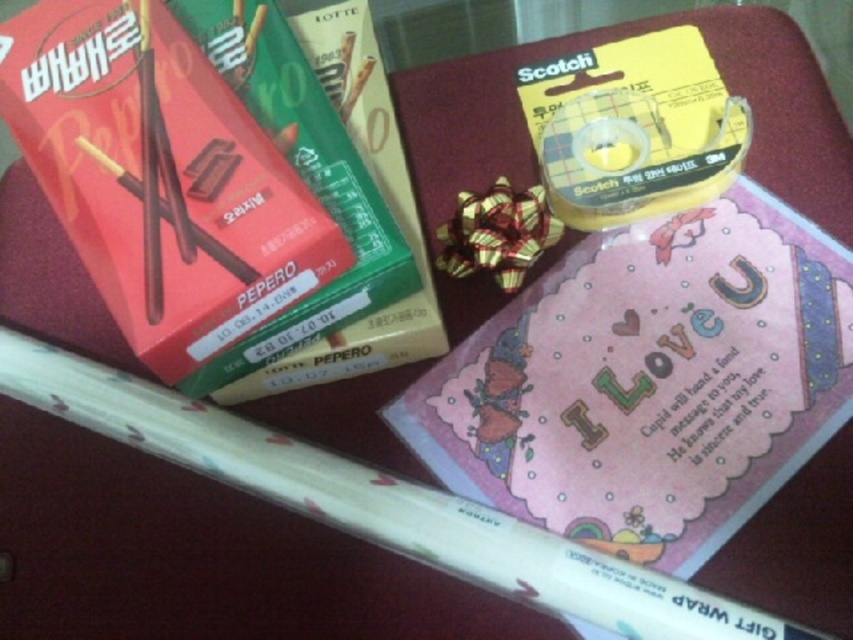
Between pink paper card at upper center and matte red box at upper left, which one is positioned lower?

pink paper card at upper center is below.

Based on the photo, can you confirm if pink paper card at upper center is smaller than matte red box at upper left?

No.

Is point (608, 298) positioned behind point (297, 92)?

Yes.

Find the location of a particular element. pink paper card at upper center is located at coordinates (648, 381).